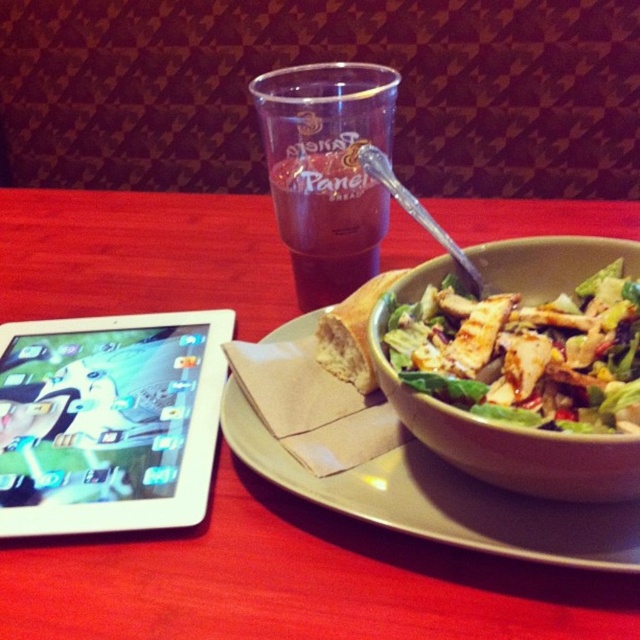
Question: Considering the relative positions of wooden table at center and white glossy tablet at left in the image provided, where is wooden table at center located with respect to white glossy tablet at left?

Choices:
 (A) above
 (B) below

Answer: (A)

Question: Based on their relative distances, which object is farther from the wooden table at center?

Choices:
 (A) matte ceramic plate at center
 (B) matte ceramic bowl at center right
 (C) white glossy tablet at left
 (D) transparent plastic cup at center

Answer: (B)

Question: Estimate the real-world distances between objects in this image. Which object is farther from the matte ceramic bowl at center right?

Choices:
 (A) transparent plastic cup at center
 (B) white glossy tablet at left
 (C) wooden table at center
 (D) matte ceramic plate at center

Answer: (C)

Question: Observing the image, what is the correct spatial positioning of white glossy tablet at left in reference to matte ceramic bowl at center right?

Choices:
 (A) right
 (B) left

Answer: (B)

Question: Does wooden table at center appear on the left side of matte ceramic plate at center?

Choices:
 (A) yes
 (B) no

Answer: (A)

Question: Which object is farther from the camera taking this photo?

Choices:
 (A) matte ceramic bowl at center right
 (B) transparent plastic cup at center

Answer: (B)